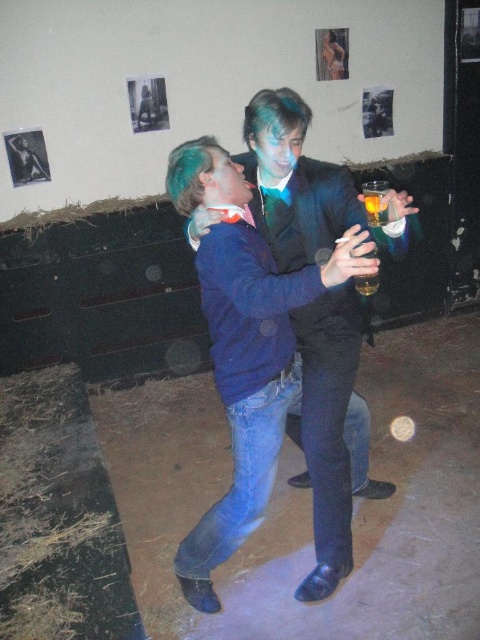
Question: Which point is farther from the camera taking this photo?

Choices:
 (A) (370, 195)
 (B) (327, 556)

Answer: (B)

Question: Is blue denim jacket at center closer to the viewer compared to translucent glass at upper right?

Choices:
 (A) yes
 (B) no

Answer: (A)

Question: Can you confirm if blue denim jacket at center is positioned to the left of translucent glass at upper right?

Choices:
 (A) no
 (B) yes

Answer: (B)

Question: Can you confirm if blue denim jacket at center is bigger than translucent glass at upper right?

Choices:
 (A) no
 (B) yes

Answer: (B)

Question: Among these objects, which one is nearest to the camera?

Choices:
 (A) translucent glass at upper right
 (B) blue denim jacket at center

Answer: (B)